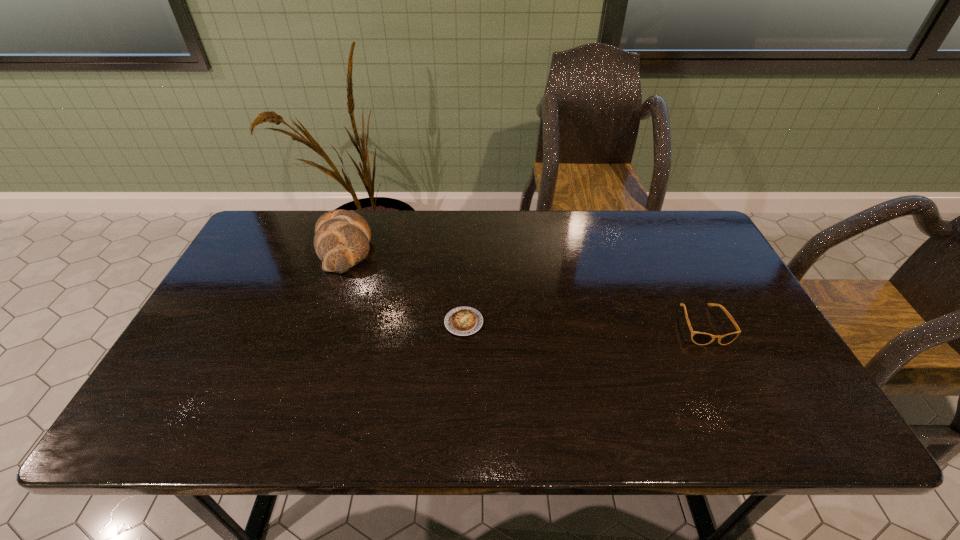
Where is `bread`? Image resolution: width=960 pixels, height=540 pixels. bread is located at coordinates (341, 241).

Locate an element on the screen. This screenshot has height=540, width=960. the tallest object is located at coordinates (341, 241).

Find the location of a particular element. the rightmost object is located at coordinates (700, 338).

I want to click on sunglasses, so click(700, 338).

Image resolution: width=960 pixels, height=540 pixels. Identify the location of the shortest object. (462, 321).

Identify the location of quiche. (462, 321).

This screenshot has height=540, width=960. Find the location of `vacant space located on the right of the farthest object`. vacant space located on the right of the farthest object is located at coordinates (461, 247).

Find the location of a particular element. This screenshot has height=540, width=960. free point located on the front-facing side of the sunglasses is located at coordinates (728, 377).

Locate an element on the screen. The height and width of the screenshot is (540, 960). vacant area located 0.230m on the right of the second object from left to right is located at coordinates (571, 323).

What are the coordinates of `object present at the far edge` in the screenshot? It's located at (341, 241).